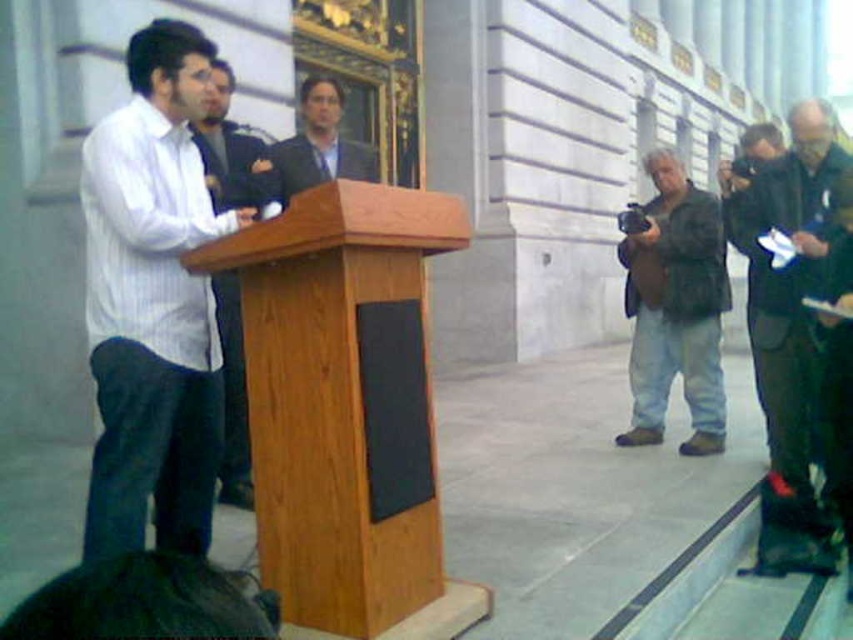
Question: Which point is farther from the camera taking this photo?

Choices:
 (A) (316, 104)
 (B) (247, 444)
 (C) (369, 424)

Answer: (A)

Question: Which object appears closest to the camera in this image?

Choices:
 (A) dark gray fabric jacket at right
 (B) denim jacket at center

Answer: (A)

Question: Among these points, which one is farthest from the camera?

Choices:
 (A) (230, 493)
 (B) (695, 321)
 (C) (173, 374)

Answer: (B)

Question: Can you confirm if dark gray fabric jacket at right is thinner than black matte speaker at center?

Choices:
 (A) no
 (B) yes

Answer: (A)

Question: Does white striped dress shirt at center appear on the right side of denim jacket at center?

Choices:
 (A) yes
 (B) no

Answer: (B)

Question: Can you confirm if wooden podium at center is bigger than denim jacket at center?

Choices:
 (A) yes
 (B) no

Answer: (B)